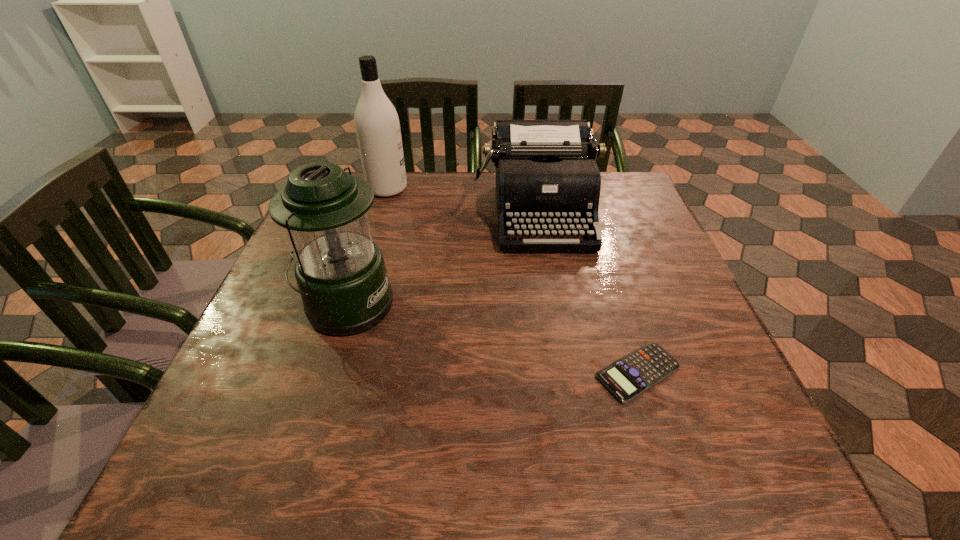
Where is `free space at the far left corner of the desktop`? This screenshot has width=960, height=540. free space at the far left corner of the desktop is located at coordinates pos(346,172).

In the image, there is a desktop. Identify the location of vacant space at the far right corner. (600, 210).

Find the location of a particular element. This screenshot has height=540, width=960. free region at the near right corner is located at coordinates (768, 466).

The width and height of the screenshot is (960, 540). I want to click on vacant area that lies between the third farthest object and the typewriter, so click(x=443, y=258).

At what (x,y) coordinates should I click in order to perform the action: click on free area in between the shampoo and the nearest object. Please return your answer as a coordinate pair (x, y). The width and height of the screenshot is (960, 540). Looking at the image, I should click on (513, 281).

What are the coordinates of `free point between the shampoo and the typewriter` in the screenshot? It's located at (463, 200).

Locate an element on the screen. This screenshot has width=960, height=540. free spot between the nearest object and the shampoo is located at coordinates (513, 281).

Locate an element on the screen. The width and height of the screenshot is (960, 540). blank region between the third tallest object and the shortest object is located at coordinates (588, 292).

Find the location of a particular element. The image size is (960, 540). free space between the shampoo and the typewriter is located at coordinates (463, 200).

Identify the location of unoccupied position between the calculator and the third farthest object. Image resolution: width=960 pixels, height=540 pixels. (492, 339).